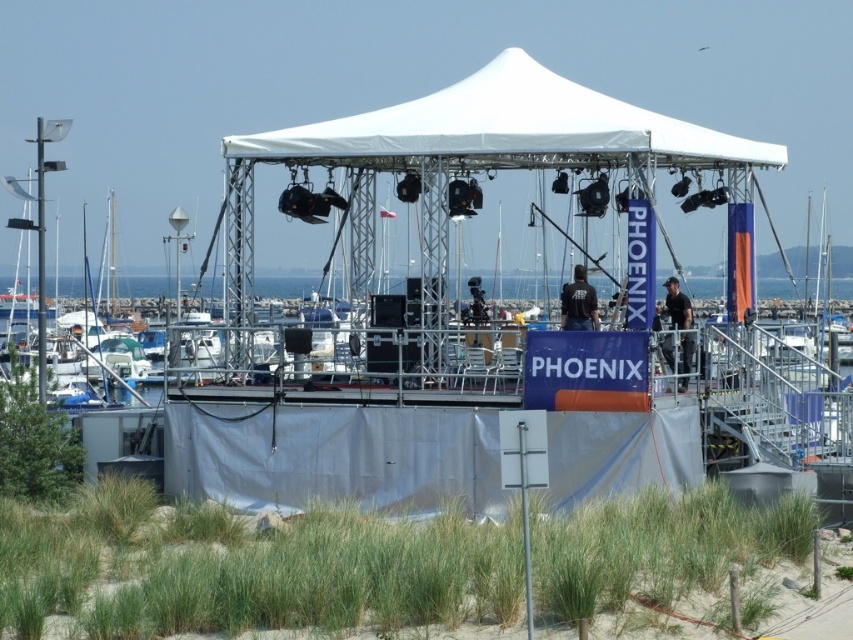
Is point (576, 100) more distant than point (262, 284)?

No.

Is white fabric canopy at center above blue water at center?

Yes, white fabric canopy at center is above blue water at center.

Is point (332, 132) positioned in front of point (303, 292)?

Yes, it is.

Where is `white fabric canopy at center`? This screenshot has width=853, height=640. white fabric canopy at center is located at coordinates (503, 124).